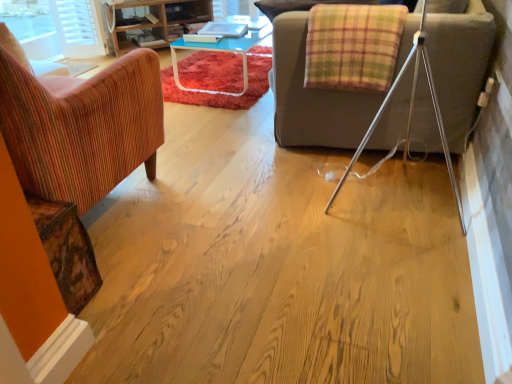
Question: Can you confirm if wooden textured armchair at left is wider than plaid fabric blanket at upper right?

Choices:
 (A) yes
 (B) no

Answer: (A)

Question: Is plaid fabric blanket at upper right surrounded by wooden textured armchair at left?

Choices:
 (A) yes
 (B) no

Answer: (B)

Question: Can you confirm if wooden textured armchair at left is positioned to the left of plaid fabric blanket at upper right?

Choices:
 (A) no
 (B) yes

Answer: (B)

Question: Does wooden textured armchair at left touch plaid fabric blanket at upper right?

Choices:
 (A) yes
 (B) no

Answer: (B)

Question: Is wooden textured armchair at left shorter than plaid fabric blanket at upper right?

Choices:
 (A) yes
 (B) no

Answer: (B)

Question: Do you think wooden shelves at upper left is within wooden textured armchair at left, or outside of it?

Choices:
 (A) outside
 (B) inside

Answer: (A)

Question: Is wooden shelves at upper left in front of or behind wooden textured armchair at left in the image?

Choices:
 (A) front
 (B) behind

Answer: (B)

Question: From their relative heights in the image, would you say wooden shelves at upper left is taller or shorter than wooden textured armchair at left?

Choices:
 (A) tall
 (B) short

Answer: (B)

Question: Is wooden shelves at upper left bigger or smaller than wooden textured armchair at left?

Choices:
 (A) small
 (B) big

Answer: (A)

Question: From a real-world perspective, is wooden shelves at upper left positioned above or below plaid fabric blanket at upper right?

Choices:
 (A) below
 (B) above

Answer: (A)

Question: Is wooden shelves at upper left in front of or behind plaid fabric blanket at upper right in the image?

Choices:
 (A) behind
 (B) front

Answer: (A)

Question: From the image's perspective, relative to plaid fabric blanket at upper right, is wooden shelves at upper left above or below?

Choices:
 (A) below
 (B) above

Answer: (B)

Question: Based on their positions, is wooden shelves at upper left located to the left or right of plaid fabric blanket at upper right?

Choices:
 (A) left
 (B) right

Answer: (A)

Question: Choose the correct answer: Is wooden textured armchair at left inside wooden shelves at upper left or outside it?

Choices:
 (A) inside
 (B) outside

Answer: (B)

Question: Is wooden textured armchair at left taller or shorter than wooden shelves at upper left?

Choices:
 (A) tall
 (B) short

Answer: (A)